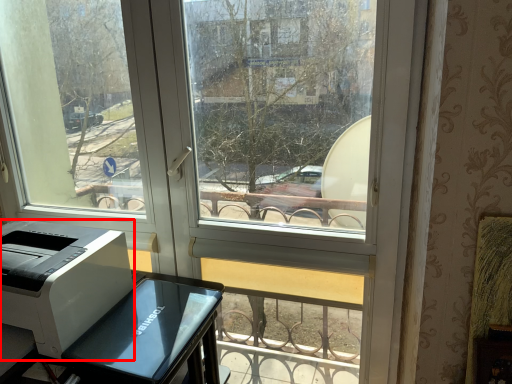
Question: From the image's perspective, what is the correct spatial positioning of printer (annotated by the red box) in reference to furniture?

Choices:
 (A) above
 (B) below

Answer: (A)